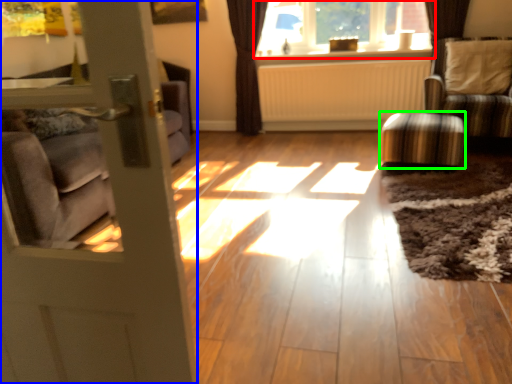
Question: Based on their relative distances, which object is farther from window (highlighted by a red box)? Choose from door (highlighted by a blue box) and stool (highlighted by a green box).

Choices:
 (A) door
 (B) stool

Answer: (A)